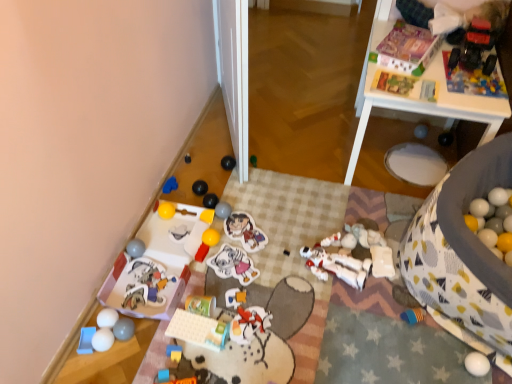
Locate an element on the screen. This screenshot has height=384, width=512. free space on the front side of white matte balls at lower left, which appears as the 2th toy when viewed from the left is located at coordinates (97, 370).